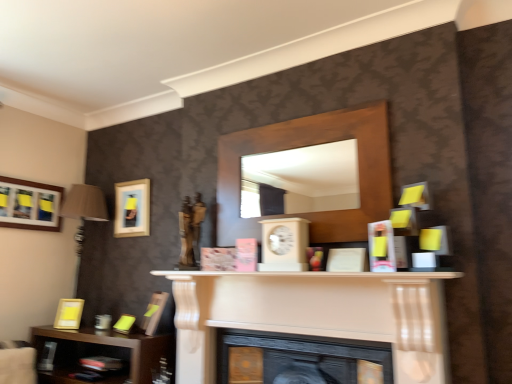
Question: From a real-world perspective, is white matte fireplace at center, arranged as the 1th fireplace when viewed from the top, physically located above or below wooden clock at center?

Choices:
 (A) above
 (B) below

Answer: (B)

Question: Is white matte fireplace at center, placed as the second fireplace when sorted from bottom to top, taller or shorter than wooden clock at center?

Choices:
 (A) short
 (B) tall

Answer: (B)

Question: Which object is positioned closest to the black matte fireplace at center, which appears as the first fireplace when ordered from the bottom?

Choices:
 (A) brown wooden shelf at lower left, marked as the first shelf in a bottom-to-top arrangement
 (B) matte gold picture frame at lower left, arranged as the 1th picture frame when viewed from the right
 (C) wooden clock at center
 (D) wooden mirror at center, the 1th shelf viewed from the right
 (E) matte black picture frame at upper left, the 2th picture frame positioned from the right

Answer: (C)

Question: Which is farther from the wooden mirror at center, which is the 1th shelf from top to bottom?

Choices:
 (A) wooden picture frame at upper left, marked as the first picture frame in a left-to-right arrangement
 (B) white matte fireplace at center, placed as the second fireplace when sorted from bottom to top
 (C) black matte fireplace at center, which appears as the first fireplace when ordered from the bottom
 (D) matte yellow picture frame at lower left, the third picture frame when ordered from right to left
 (E) brown wooden shelf at lower left, marked as the first shelf in a bottom-to-top arrangement

Answer: (A)